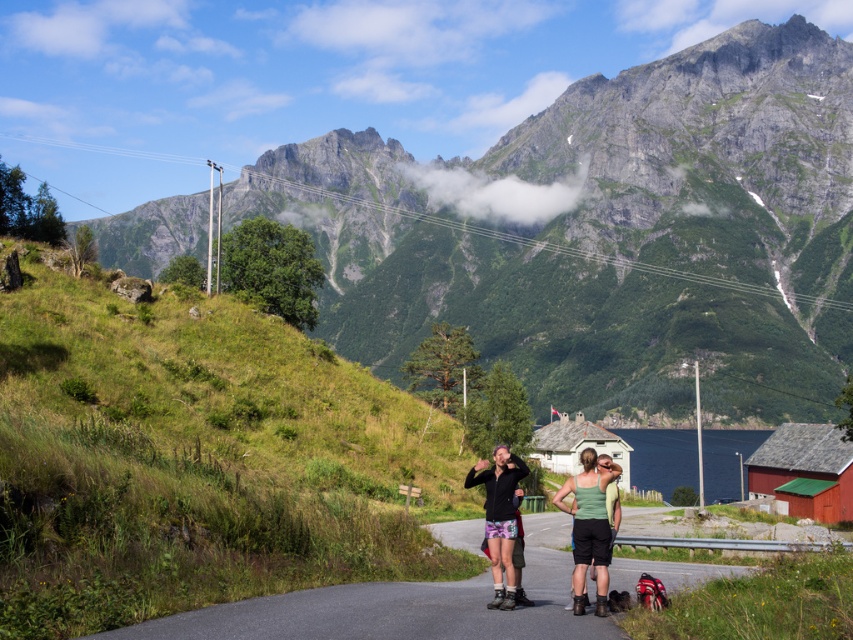
Question: Does gray rocky mountain at upper center appear over matte black jacket at center?

Choices:
 (A) no
 (B) yes

Answer: (B)

Question: Estimate the real-world distances between objects in this image. Which object is closer to the gray rocky mountain at upper center?

Choices:
 (A) matte black jacket at center
 (B) green fabric tank top at center

Answer: (B)

Question: Is gray rocky mountain at upper center thinner than green fabric tank top at center?

Choices:
 (A) yes
 (B) no

Answer: (B)

Question: Among these objects, which one is nearest to the camera?

Choices:
 (A) gray rocky mountain at upper center
 (B) matte black jacket at center

Answer: (B)

Question: Does gray rocky mountain at upper center come behind matte black jacket at center?

Choices:
 (A) no
 (B) yes

Answer: (B)

Question: Which is farther from the matte black jacket at center?

Choices:
 (A) gray rocky mountain at upper center
 (B) green fabric tank top at center

Answer: (A)